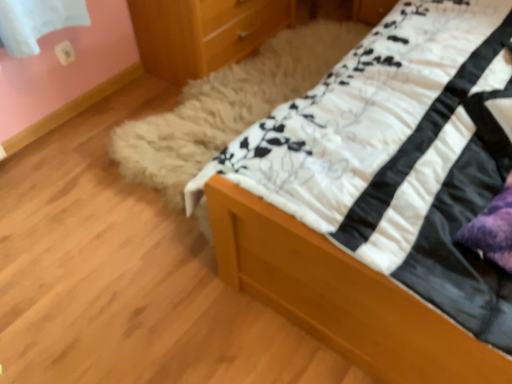
What do you see at coordinates (203, 33) in the screenshot? I see `wooden chest of drawers at upper center` at bounding box center [203, 33].

You are a GUI agent. You are given a task and a screenshot of the screen. Output one action in this format:
    pyautogui.click(x=<x>, y=<y>)
    Task: Click on the wooden chest of drawers at upper center
    This screenshot has height=384, width=512.
    Given the screenshot: What is the action you would take?
    pyautogui.click(x=203, y=33)

The width and height of the screenshot is (512, 384). Identify the location of white soft quilt at upper right. (377, 197).

The width and height of the screenshot is (512, 384). Describe the element at coordinates (377, 197) in the screenshot. I see `white soft quilt at upper right` at that location.

You are a GUI agent. You are given a task and a screenshot of the screen. Output one action in this format:
    pyautogui.click(x=<x>, y=<y>)
    Task: Click on the wooden chest of drawers at upper center
    This screenshot has height=384, width=512.
    Given the screenshot: What is the action you would take?
    pos(203,33)

Which is more to the right, wooden chest of drawers at upper center or white soft quilt at upper right?

Positioned to the right is white soft quilt at upper right.

Looking at this image, considering the relative positions of wooden chest of drawers at upper center and white soft quilt at upper right in the image provided, is wooden chest of drawers at upper center behind white soft quilt at upper right?

Yes, the depth of wooden chest of drawers at upper center is greater than that of white soft quilt at upper right.

Is point (234, 42) positioned in front of point (398, 294)?

That is False.

From the image's perspective, is wooden chest of drawers at upper center located above white soft quilt at upper right?

Indeed, from the image's perspective, wooden chest of drawers at upper center is shown above white soft quilt at upper right.

From a real-world perspective, which object stands above the other?

wooden chest of drawers at upper center is physically above.

Does wooden chest of drawers at upper center have a lesser width compared to white soft quilt at upper right?

Yes, wooden chest of drawers at upper center is thinner than white soft quilt at upper right.

Looking at this image, which of these two, wooden chest of drawers at upper center or white soft quilt at upper right, stands taller?

wooden chest of drawers at upper center.

In terms of size, does wooden chest of drawers at upper center appear bigger or smaller than white soft quilt at upper right?

In the image, wooden chest of drawers at upper center appears to be smaller than white soft quilt at upper right.

Is white soft quilt at upper right located within wooden chest of drawers at upper center?

No, white soft quilt at upper right is not surrounded by wooden chest of drawers at upper center.

Is wooden chest of drawers at upper center with white soft quilt at upper right?

No.

Is wooden chest of drawers at upper center oriented away from white soft quilt at upper right?

wooden chest of drawers at upper center is not turned away from white soft quilt at upper right.

How many degrees apart are the facing directions of wooden chest of drawers at upper center and white soft quilt at upper right?

They differ by 89.7 degrees in their facing directions.

Where is `chest of drawers on the left of white soft quilt at upper right`? This screenshot has width=512, height=384. chest of drawers on the left of white soft quilt at upper right is located at coordinates (203, 33).

Which is more to the left, white soft quilt at upper right or wooden chest of drawers at upper center?

Positioned to the left is wooden chest of drawers at upper center.

Consider the image. Relative to wooden chest of drawers at upper center, is white soft quilt at upper right in front or behind?

white soft quilt at upper right is positioned closer to the viewer than wooden chest of drawers at upper center.

Is point (383, 377) closer or farther from the camera than point (237, 42)?

Point (383, 377).

From the image's perspective, is white soft quilt at upper right positioned above or below wooden chest of drawers at upper center?

Clearly, from the image's perspective, white soft quilt at upper right is below wooden chest of drawers at upper center.

Based on the photo, from a real-world perspective, does white soft quilt at upper right sit lower than wooden chest of drawers at upper center?

Yes, from a real-world perspective, white soft quilt at upper right is beneath wooden chest of drawers at upper center.

Looking at their sizes, would you say white soft quilt at upper right is wider or thinner than wooden chest of drawers at upper center?

Considering their sizes, white soft quilt at upper right looks broader than wooden chest of drawers at upper center.

Considering the sizes of white soft quilt at upper right and wooden chest of drawers at upper center in the image, is white soft quilt at upper right taller or shorter than wooden chest of drawers at upper center?

Considering their sizes, white soft quilt at upper right has less height than wooden chest of drawers at upper center.

Between white soft quilt at upper right and wooden chest of drawers at upper center, which one has larger size?

white soft quilt at upper right.

In the scene shown: Is wooden chest of drawers at upper center completely or partially inside white soft quilt at upper right?

That's incorrect, wooden chest of drawers at upper center is not inside white soft quilt at upper right.

Is white soft quilt at upper right positioned far away from wooden chest of drawers at upper center?

Actually, white soft quilt at upper right and wooden chest of drawers at upper center are a little close together.

Is white soft quilt at upper right oriented towards wooden chest of drawers at upper center?

No, white soft quilt at upper right does not turn towards wooden chest of drawers at upper center.

The height and width of the screenshot is (384, 512). I want to click on the chest of drawers that appears behind the white soft quilt at upper right, so click(x=203, y=33).

Where is `chest of drawers above the white soft quilt at upper right (from a real-world perspective)`? chest of drawers above the white soft quilt at upper right (from a real-world perspective) is located at coordinates (203, 33).

Where is `bed that is on the right side of wooden chest of drawers at upper center`? This screenshot has width=512, height=384. bed that is on the right side of wooden chest of drawers at upper center is located at coordinates (377, 197).